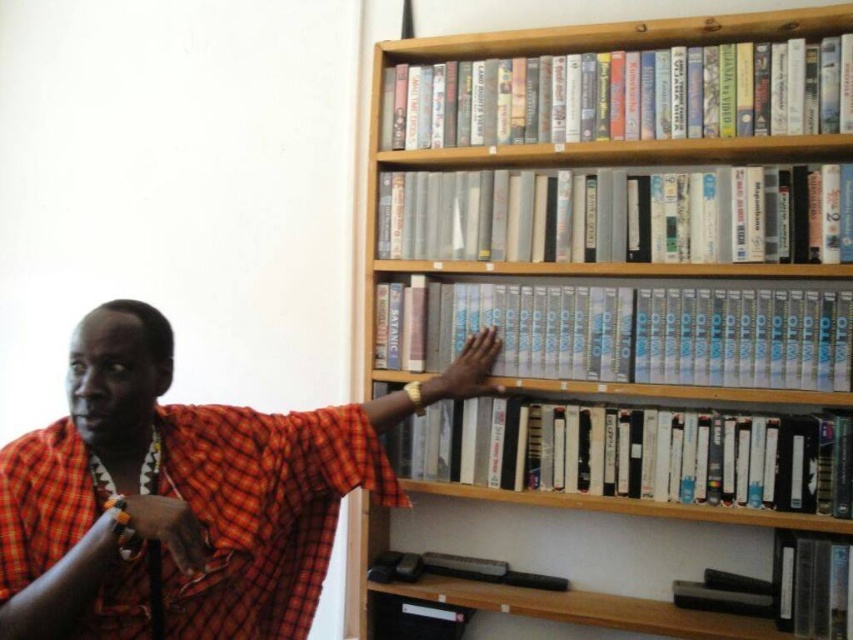
Is point (548, 250) farther from camera compared to point (474, 358)?

No, it is in front of (474, 358).

Measure the distance between white plastic book at center and smooth skin hand at center.

37.52 centimeters

Which is behind, point (607, 179) or point (473, 349)?

Positioned behind is point (473, 349).

Locate an element on the screen. white plastic book at center is located at coordinates (604, 216).

Is white plastic book at center behind white plastic cassette at center?

No, white plastic book at center is closer to the viewer.

Is white plastic book at center smaller than white plastic cassette at center?

No, white plastic book at center is not smaller than white plastic cassette at center.

This screenshot has height=640, width=853. I want to click on white plastic book at center, so pyautogui.click(x=604, y=216).

I want to click on white plastic book at center, so click(x=604, y=216).

Which of these two, white glossy book at upper center or smooth orange cloth at lower left, stands taller?

white glossy book at upper center

Does white glossy book at upper center have a larger size compared to smooth orange cloth at lower left?

Yes.

Is point (786, 51) closer to camera compared to point (160, 497)?

No.

You are a GUI agent. You are given a task and a screenshot of the screen. Output one action in this format:
    pyautogui.click(x=<x>, y=<y>)
    Task: Click on the white glossy book at upper center
    The width and height of the screenshot is (853, 640).
    Given the screenshot: What is the action you would take?
    pyautogui.click(x=621, y=96)